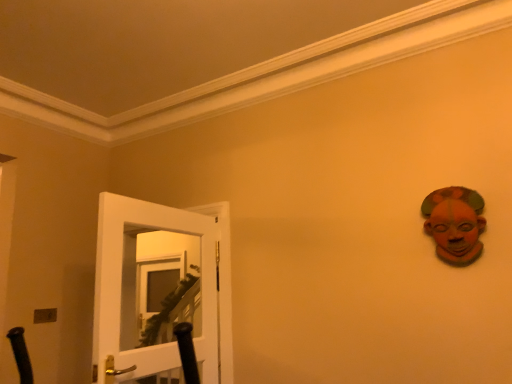
You are a GUI agent. You are given a task and a screenshot of the screen. Output one action in this format:
    pyautogui.click(x=<x>, y=<y>)
    Task: Click on the terracotta clay mask at upper right
    The image size is (512, 384).
    Given the screenshot: What is the action you would take?
    pyautogui.click(x=455, y=223)

Which object is positioned more to the left, metallic silver light switch at lower left or terracotta clay mask at upper right?

metallic silver light switch at lower left.

Is metallic silver light switch at lower left thinner than terracotta clay mask at upper right?

Indeed, metallic silver light switch at lower left has a lesser width compared to terracotta clay mask at upper right.

Find the location of `light switch on the left of terracotta clay mask at upper right`. light switch on the left of terracotta clay mask at upper right is located at coordinates (45, 315).

Is white glossy door at left located outside terracotta clay mask at upper right?

Yes, white glossy door at left is located beyond the bounds of terracotta clay mask at upper right.

Which of these two, white glossy door at left or terracotta clay mask at upper right, stands taller?

With more height is white glossy door at left.

Which object is closer to the camera taking this photo, white glossy door at left or terracotta clay mask at upper right?

Positioned in front is white glossy door at left.

Which of these two, metallic silver light switch at lower left or white glossy door at left, is smaller?

metallic silver light switch at lower left is smaller.

What are the coordinates of `light switch on the left of white glossy door at left` in the screenshot? It's located at (45, 315).

Is metallic silver light switch at lower left with white glossy door at left?

No, metallic silver light switch at lower left is not touching white glossy door at left.

How distant is metallic silver light switch at lower left from white glossy door at left?

The distance of metallic silver light switch at lower left from white glossy door at left is 29.80 inches.

Considering the sizes of objects terracotta clay mask at upper right and white glossy door at left in the image provided, who is bigger, terracotta clay mask at upper right or white glossy door at left?

With larger size is white glossy door at left.

Which of these two, terracotta clay mask at upper right or white glossy door at left, is thinner?

terracotta clay mask at upper right is thinner.

Considering the relative positions of terracotta clay mask at upper right and white glossy door at left in the image provided, is terracotta clay mask at upper right to the left or to the right of white glossy door at left?

In the image, terracotta clay mask at upper right appears on the right side of white glossy door at left.

At what (x,y) coordinates should I click in order to perform the action: click on door located below the terracotta clay mask at upper right (from the image's perspective). Please return your answer as a coordinate pair (x, y). The image size is (512, 384). Looking at the image, I should click on (153, 292).

Choose the correct answer: Is white glossy door at left inside metallic silver light switch at lower left or outside it?

white glossy door at left is not inside metallic silver light switch at lower left, it's outside.

Which of these two, white glossy door at left or metallic silver light switch at lower left, stands shorter?

With less height is metallic silver light switch at lower left.

Is point (186, 217) more distant than point (54, 319)?

No, (186, 217) is in front of (54, 319).

Is metallic silver light switch at lower left inside terracotta clay mask at upper right?

No, metallic silver light switch at lower left is located outside of terracotta clay mask at upper right.

From their relative heights in the image, would you say terracotta clay mask at upper right is taller or shorter than metallic silver light switch at lower left?

terracotta clay mask at upper right is taller than metallic silver light switch at lower left.

Based on the photo, looking at the image, does terracotta clay mask at upper right seem bigger or smaller compared to metallic silver light switch at lower left?

Considering their sizes, terracotta clay mask at upper right takes up more space than metallic silver light switch at lower left.

Locate an element on the screen. This screenshot has height=384, width=512. light switch that appears on the left of terracotta clay mask at upper right is located at coordinates (45, 315).

Where is `door in front of the terracotta clay mask at upper right`? This screenshot has width=512, height=384. door in front of the terracotta clay mask at upper right is located at coordinates (153, 292).

Considering their positions, is metallic silver light switch at lower left positioned closer to white glossy door at left than terracotta clay mask at upper right?

metallic silver light switch at lower left lies closer to white glossy door at left than the other object.

Looking at this image, from the image, which object appears to be nearer to metallic silver light switch at lower left, white glossy door at left or terracotta clay mask at upper right?

white glossy door at left.

Based on their spatial positions, is terracotta clay mask at upper right or white glossy door at left closer to metallic silver light switch at lower left?

Based on the image, white glossy door at left appears to be nearer to metallic silver light switch at lower left.

From the image, which object appears to be farther from white glossy door at left, terracotta clay mask at upper right or metallic silver light switch at lower left?

Based on the image, terracotta clay mask at upper right appears to be further to white glossy door at left.

When comparing their distances from terracotta clay mask at upper right, does white glossy door at left or metallic silver light switch at lower left seem further?

metallic silver light switch at lower left.

Considering their positions, is metallic silver light switch at lower left positioned further to terracotta clay mask at upper right than white glossy door at left?

The object further to terracotta clay mask at upper right is metallic silver light switch at lower left.

Image resolution: width=512 pixels, height=384 pixels. Identify the location of door between metallic silver light switch at lower left and terracotta clay mask at upper right. (153, 292).